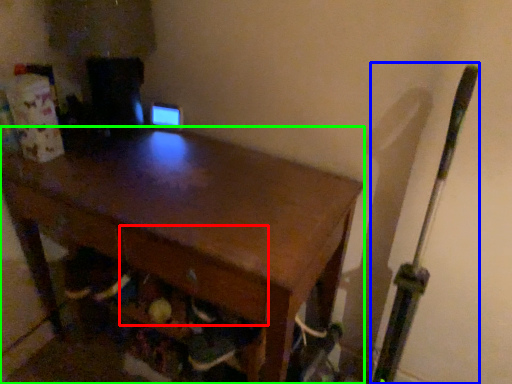
Question: Considering the real-world distances, which object is farthest from drawer (highlighted by a red box)? baseball bat (highlighted by a blue box) or desk (highlighted by a green box)?

Choices:
 (A) baseball bat
 (B) desk

Answer: (A)